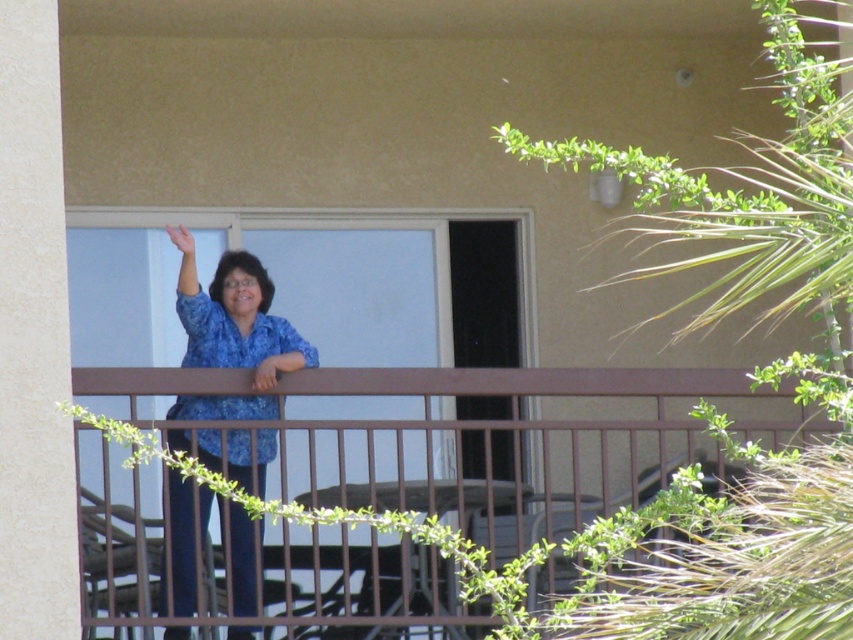
You are a photographer trying to capture a clear shot of the blue printed blouse at center and the smooth brown hand at center. Which object should you focus on first to ensure it appears sharp in the photo?

You should focus on the blue printed blouse at center first because it is closer to the viewer than the smooth brown hand at center, ensuring it will be in focus before adjusting for the hand.

You are standing on the balcony and want to take a photo of the point at coordinates point (256,339). If your camera has a maximum focus range of 12 meters, will it be able to focus on that point?

The distance of point (256,339) from the camera is 11.98 meters, which is within the camera maximum focus range of 12 meters. Therefore, the camera can focus on that point.